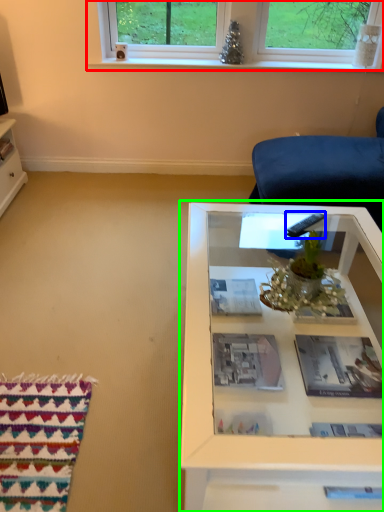
Question: Considering the real-world distances, which object is closest to window (highlighted by a red box)? remote (highlighted by a blue box) or table (highlighted by a green box).

Choices:
 (A) remote
 (B) table

Answer: (A)